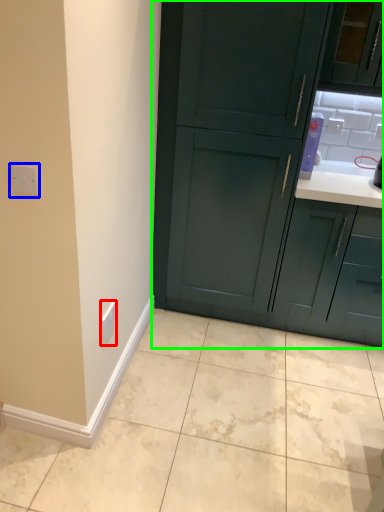
Question: Based on their relative distances, which object is farther from electric outlet (highlighted by a red box)? Choose from electric outlet (highlighted by a blue box) and cabinetry (highlighted by a green box).

Choices:
 (A) electric outlet
 (B) cabinetry

Answer: (B)